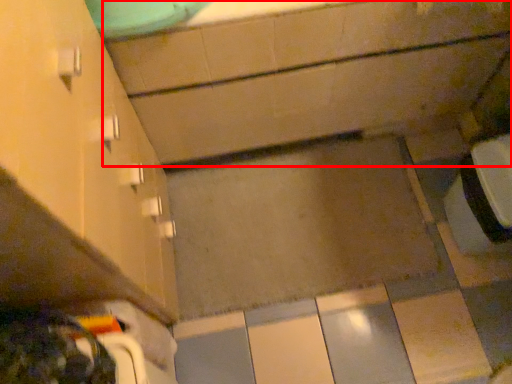
Question: Considering the relative positions of bath (annotated by the red box) and cabinetry in the image provided, where is bath (annotated by the red box) located with respect to the staircase?

Choices:
 (A) left
 (B) right

Answer: (B)